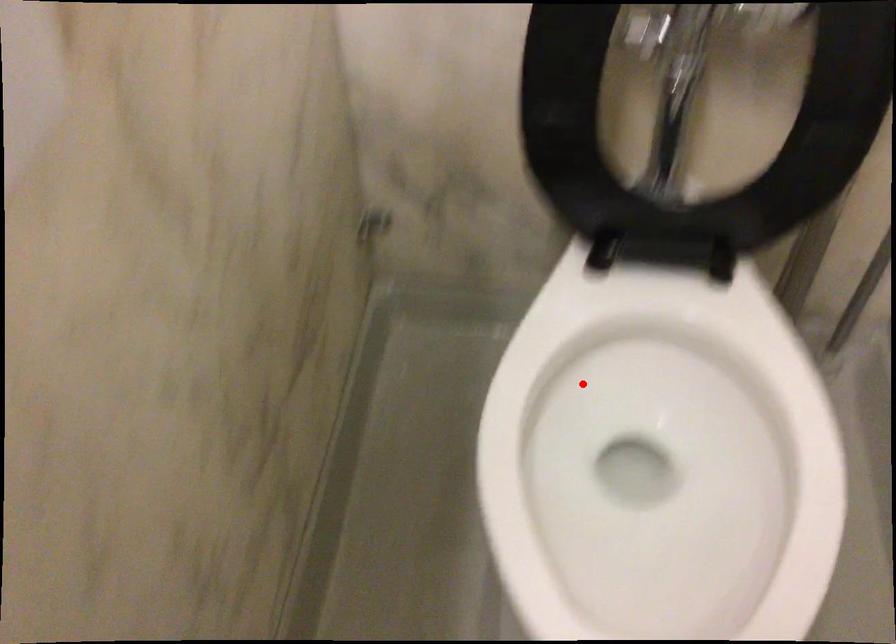
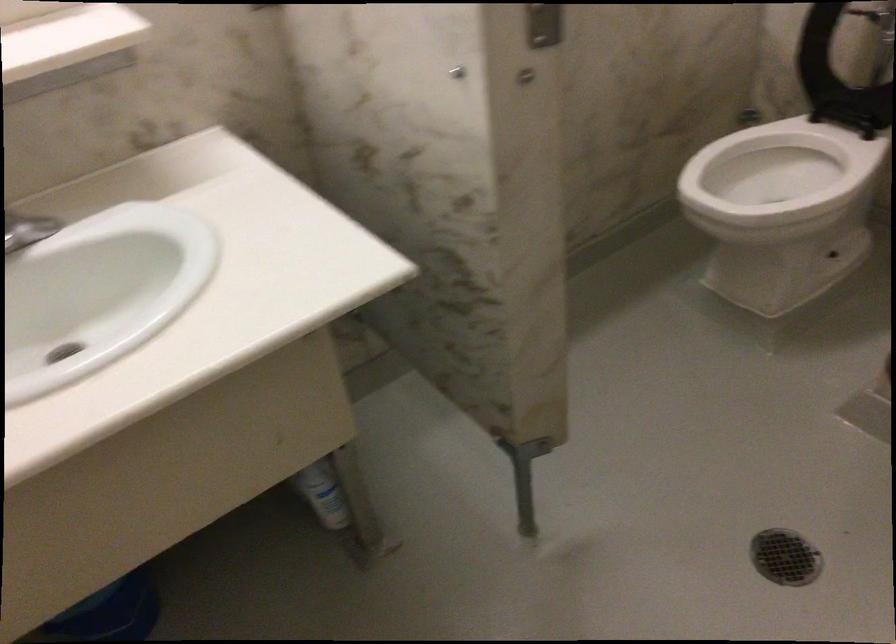
Question: I am providing you with two images of the same scene from different viewpoints. Given a red point in image1, look at the same physical point in image2. Is it:

Choices:
 (A) Closer to the viewpoint
 (B) Farther from the viewpoint

Answer: (B)